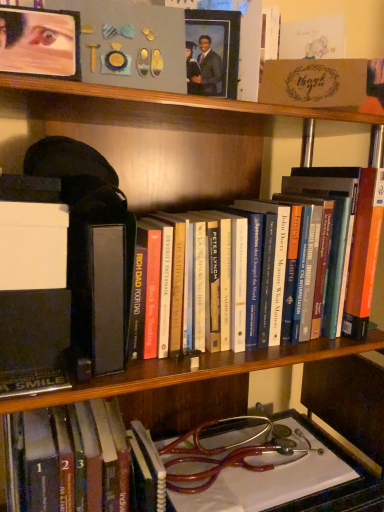
This screenshot has width=384, height=512. What are the coordinates of `matte black picture frame at upper center` in the screenshot? It's located at click(212, 52).

Locate an element on the screen. This screenshot has height=512, width=384. hardcover book at center, the 1th book positioned from the top is located at coordinates (351, 230).

What are the coordinates of `picture frame behind the hardcover book at center, the 1th book positioned from the top` in the screenshot? It's located at (212, 52).

Is matte black picture frame at upper center located within hardcover book at center, the second book when ordered from bottom to top?

No, hardcover book at center, the second book when ordered from bottom to top, does not contain matte black picture frame at upper center.

Does hardcover book at center, the 1th book positioned from the top, touch matte black picture frame at upper center?

No, hardcover book at center, the 1th book positioned from the top, is not next to matte black picture frame at upper center.

From the picture: Can you tell me how much hardcover book at center, the 1th book positioned from the top, and matte black picture frame at upper center differ in facing direction?

The angle between the facing direction of hardcover book at center, the 1th book positioned from the top, and the facing direction of matte black picture frame at upper center is 27.1 degrees.

Does matte black picture frame at upper center turn towards hardcover book at center, the 1th book positioned from the top?

No, matte black picture frame at upper center is not facing towards hardcover book at center, the 1th book positioned from the top.

From the image's perspective, does matte black picture frame at upper center appear higher than hardcover book at center, the second book when ordered from bottom to top?

Yes, from the image's perspective, matte black picture frame at upper center is over hardcover book at center, the second book when ordered from bottom to top.

Which of these two, matte black picture frame at upper center or hardcover book at center, the second book when ordered from bottom to top, is bigger?

hardcover book at center, the second book when ordered from bottom to top.

Is hardcover book at center, the second book when ordered from bottom to top, facing away from hardcover book at center, positioned as the second book in top-to-bottom order?

No, hardcover book at center, the second book when ordered from bottom to top, is not facing away from hardcover book at center, positioned as the second book in top-to-bottom order.

From the image's perspective, is hardcover book at center, the second book when ordered from bottom to top, positioned above or below hardcover book at center, the first book in the bottom-to-top sequence?

Based on their image positions, hardcover book at center, the second book when ordered from bottom to top, is located above hardcover book at center, the first book in the bottom-to-top sequence.

Is hardcover book at center, the 1th book positioned from the top, thinner than hardcover book at center, positioned as the second book in top-to-bottom order?

Yes, hardcover book at center, the 1th book positioned from the top, is thinner than hardcover book at center, positioned as the second book in top-to-bottom order.

Looking at this image, in terms of size, does hardcover book at center, the second book when ordered from bottom to top, appear bigger or smaller than hardcover book at center, positioned as the second book in top-to-bottom order?

hardcover book at center, the second book when ordered from bottom to top, is bigger than hardcover book at center, positioned as the second book in top-to-bottom order.

Is point (58, 435) behind point (224, 55)?

Yes.

Visually, is hardcover book at center, positioned as the second book in top-to-bottom order, positioned to the left or to the right of matte black picture frame at upper center?

hardcover book at center, positioned as the second book in top-to-bottom order, is to the left of matte black picture frame at upper center.

Which of these two, hardcover book at center, the first book in the bottom-to-top sequence, or matte black picture frame at upper center, stands taller?

With more height is hardcover book at center, the first book in the bottom-to-top sequence.

Considering the relative positions of matte black picture frame at upper center and hardcover book at center, positioned as the second book in top-to-bottom order, in the image provided, is matte black picture frame at upper center to the right of hardcover book at center, positioned as the second book in top-to-bottom order, from the viewer's perspective?

Yes, matte black picture frame at upper center is to the right of hardcover book at center, positioned as the second book in top-to-bottom order.

Is matte black picture frame at upper center in front of hardcover book at center, positioned as the second book in top-to-bottom order?

No.

Can hardcover book at center, the first book in the bottom-to-top sequence, be found inside matte black picture frame at upper center?

No, hardcover book at center, the first book in the bottom-to-top sequence, is not surrounded by matte black picture frame at upper center.

Does matte black picture frame at upper center have a lesser height compared to hardcover book at center, the first book in the bottom-to-top sequence?

Yes, matte black picture frame at upper center is shorter than hardcover book at center, the first book in the bottom-to-top sequence.

Considering the points (51, 415) and (335, 185), which point is behind, point (51, 415) or point (335, 185)?

The point (335, 185) is behind.

Is hardcover book at center, positioned as the second book in top-to-bottom order, completely or partially outside of hardcover book at center, the 1th book positioned from the top?

Yes, hardcover book at center, positioned as the second book in top-to-bottom order, is not within hardcover book at center, the 1th book positioned from the top.

Is hardcover book at center, positioned as the second book in top-to-bottom order, placed right next to hardcover book at center, the second book when ordered from bottom to top?

hardcover book at center, positioned as the second book in top-to-bottom order, and hardcover book at center, the second book when ordered from bottom to top, are clearly separated.

This screenshot has width=384, height=512. Find the location of `book on the right of hardcover book at center, positioned as the second book in top-to-bottom order`. book on the right of hardcover book at center, positioned as the second book in top-to-bottom order is located at coordinates (351, 230).

This screenshot has height=512, width=384. I want to click on picture frame to the left of hardcover book at center, the second book when ordered from bottom to top, so click(x=212, y=52).

Image resolution: width=384 pixels, height=512 pixels. Identify the location of the 1st book below the matte black picture frame at upper center (from the image's perspective). (351, 230).

When comparing their distances from hardcover book at center, the 1th book positioned from the top, does matte black picture frame at upper center or hardcover book at center, the first book in the bottom-to-top sequence, seem further?

The object further to hardcover book at center, the 1th book positioned from the top, is hardcover book at center, the first book in the bottom-to-top sequence.

When comparing their distances from hardcover book at center, the second book when ordered from bottom to top, does hardcover book at center, positioned as the second book in top-to-bottom order, or matte black picture frame at upper center seem further?

The object further to hardcover book at center, the second book when ordered from bottom to top, is hardcover book at center, positioned as the second book in top-to-bottom order.

When comparing their distances from matte black picture frame at upper center, does hardcover book at center, the first book in the bottom-to-top sequence, or hardcover book at center, the 1th book positioned from the top, seem closer?

Among the two, hardcover book at center, the 1th book positioned from the top, is located nearer to matte black picture frame at upper center.

Looking at the image, which one is located closer to matte black picture frame at upper center, hardcover book at center, the second book when ordered from bottom to top, or hardcover book at center, positioned as the second book in top-to-bottom order?

hardcover book at center, the second book when ordered from bottom to top, is positioned closer to the anchor matte black picture frame at upper center.

Based on their spatial positions, is hardcover book at center, the second book when ordered from bottom to top, or matte black picture frame at upper center closer to hardcover book at center, the first book in the bottom-to-top sequence?

hardcover book at center, the second book when ordered from bottom to top, is closer to hardcover book at center, the first book in the bottom-to-top sequence.

From the image, which object appears to be nearer to hardcover book at center, the first book in the bottom-to-top sequence, matte black picture frame at upper center or hardcover book at center, the 1th book positioned from the top?

hardcover book at center, the 1th book positioned from the top, lies closer to hardcover book at center, the first book in the bottom-to-top sequence, than the other object.

Find the location of a particular element. The image size is (384, 512). book that lies between matte black picture frame at upper center and hardcover book at center, the first book in the bottom-to-top sequence, from top to bottom is located at coordinates (351, 230).